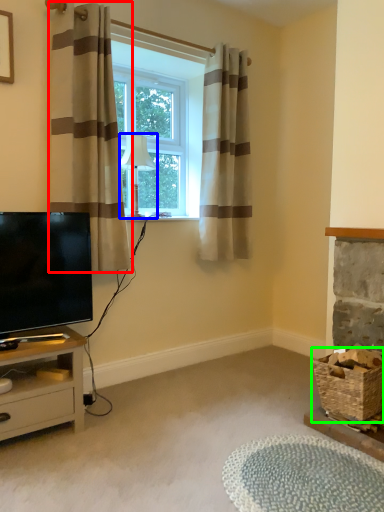
Question: Estimate the real-world distances between objects in this image. Which object is farther from curtain (highlighted by a red box), lamp (highlighted by a blue box) or basket (highlighted by a green box)?

Choices:
 (A) lamp
 (B) basket

Answer: (B)